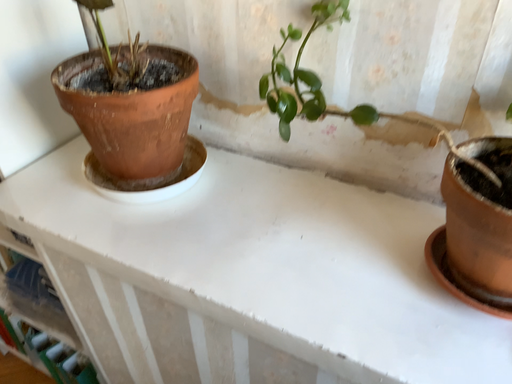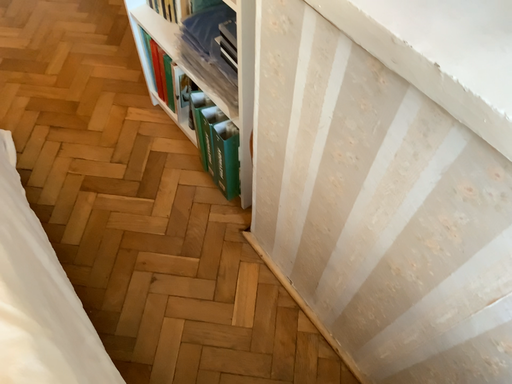
Question: How did the camera likely rotate when shooting the video?

Choices:
 (A) rotated left
 (B) rotated right

Answer: (A)